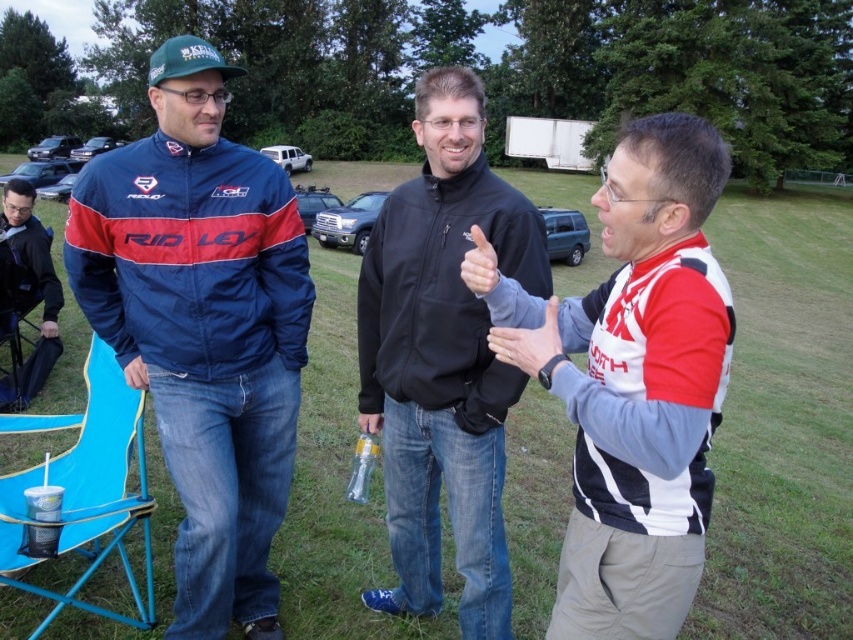
Question: Which object is farther from the camera taking this photo?

Choices:
 (A) black fabric chair at lower left
 (B) clear plastic bottle at center
 (C) blue plastic folding chair at lower left

Answer: (A)

Question: Which of the following is the closest to the observer?

Choices:
 (A) black softshell jacket at center
 (B) black fabric chair at lower left
 (C) white and black jersey at right

Answer: (C)

Question: Is white and black jersey at right thinner than black fabric chair at lower left?

Choices:
 (A) no
 (B) yes

Answer: (A)

Question: Can you confirm if black softshell jacket at center is positioned to the right of blue plastic folding chair at lower left?

Choices:
 (A) no
 (B) yes

Answer: (B)

Question: Can you confirm if matte blue jacket at left is positioned below white and black jersey at right?

Choices:
 (A) no
 (B) yes

Answer: (A)

Question: Which point is farther to the camera?

Choices:
 (A) matte blue jacket at left
 (B) clear plastic bottle at center

Answer: (B)